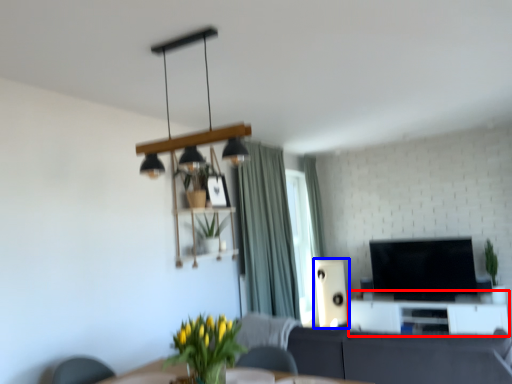
Question: Which of the following is the closest to the observer, entertainment center (highlighted by a red box) or speaker (highlighted by a blue box)?

Choices:
 (A) entertainment center
 (B) speaker

Answer: (A)